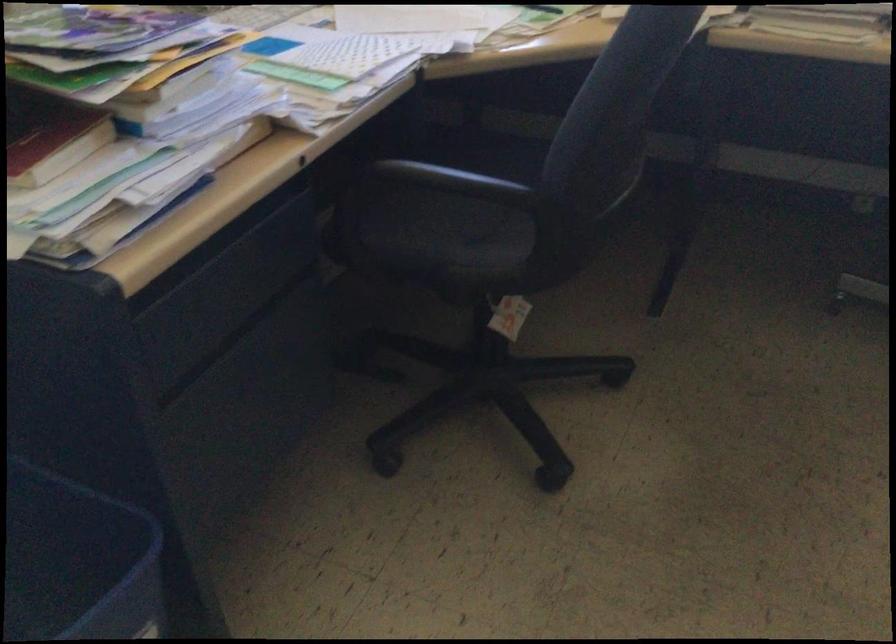
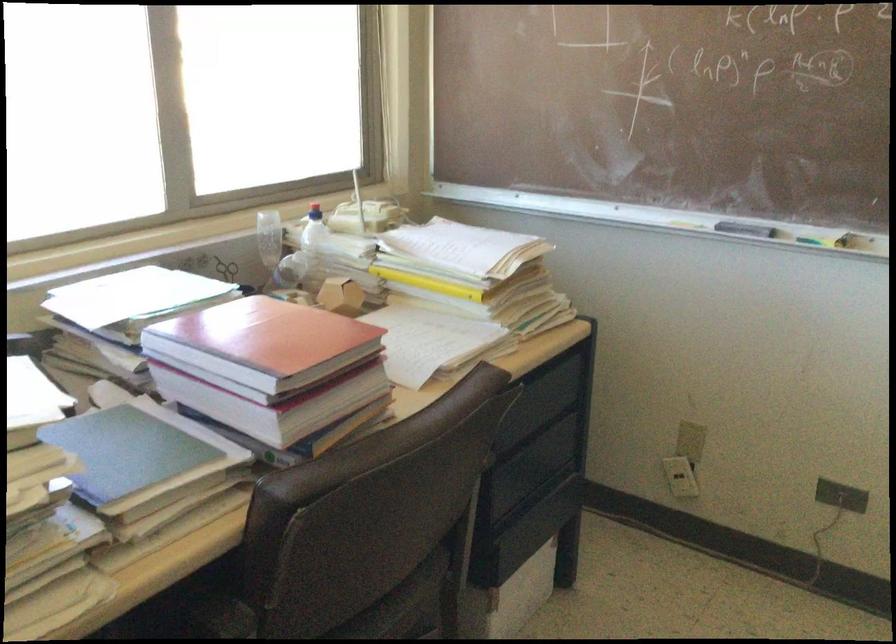
Question: The first image is from the beginning of the video and the second image is from the end. How did the camera likely rotate when shooting the video?

Choices:
 (A) Left
 (B) Right
 (C) Up
 (D) Down

Answer: (B)